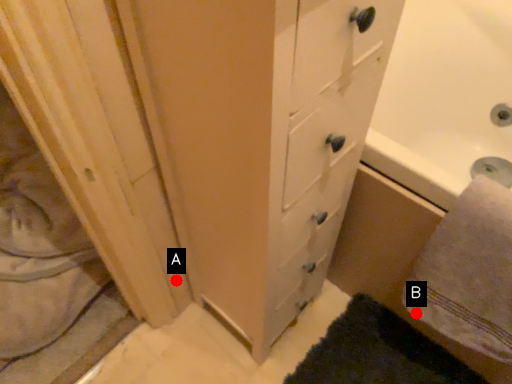
Question: Two points are circled on the image, labeled by A and B beside each circle. Which point is further to the camera?

Choices:
 (A) A is further
 (B) B is further

Answer: (A)